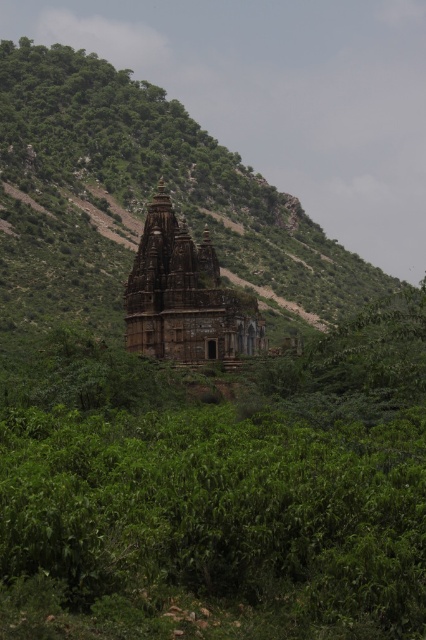
Is point (101, 72) less distant than point (158, 316)?

No, (101, 72) is further to viewer.

Based on the photo, between green leafy mountain at center and brown stone hindu temple at center, which one has less height?

With less height is brown stone hindu temple at center.

Is point (354, 256) positioned after point (158, 321)?

Yes, point (354, 256) is farther from viewer.

Locate an element on the screen. green leafy mountain at center is located at coordinates (141, 196).